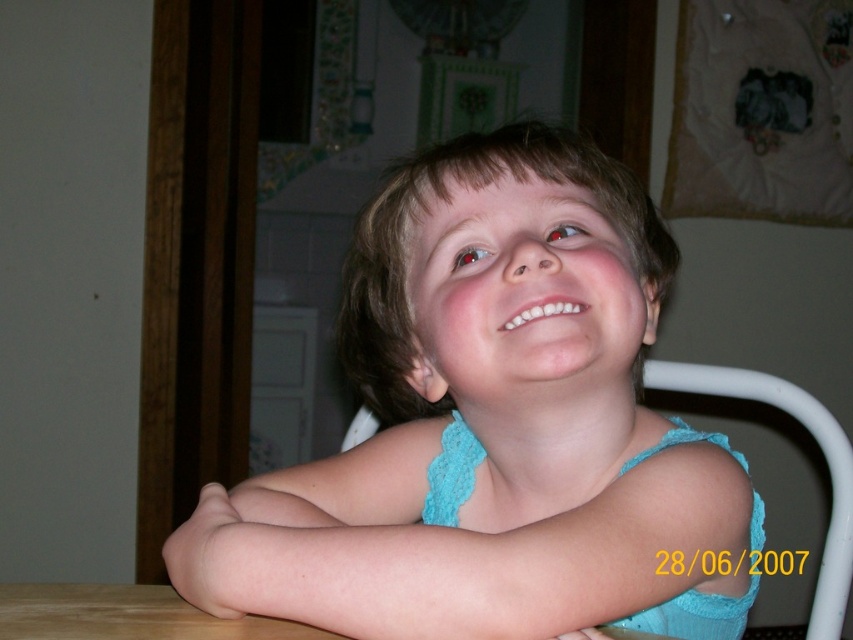
Is point (463, 529) more distant than point (814, 593)?

That is False.

What do you see at coordinates (456, 545) in the screenshot? I see `smooth skin at lower center` at bounding box center [456, 545].

Is point (585, 624) positioned in front of point (370, 435)?

Yes, point (585, 624) is in front of point (370, 435).

At what (x,y) coordinates should I click in order to perform the action: click on smooth skin at lower center. Please return your answer as a coordinate pair (x, y). Image resolution: width=853 pixels, height=640 pixels. Looking at the image, I should click on (456, 545).

Between light blue fabric at center and white plastic chair at center, which one has less height?

With less height is white plastic chair at center.

Does light blue fabric at center appear on the left side of white plastic chair at center?

Yes, light blue fabric at center is to the left of white plastic chair at center.

Describe the element at coordinates (492, 424) in the screenshot. I see `light blue fabric at center` at that location.

Where is `light blue fabric at center`? The width and height of the screenshot is (853, 640). light blue fabric at center is located at coordinates (492, 424).

Locate an element on the screen. light blue fabric at center is located at coordinates [x=492, y=424].

Is light blue fabric at center shorter than smooth skin at lower center?

No.

Is point (322, 509) closer to camera compared to point (437, 612)?

No.

I want to click on light blue fabric at center, so click(492, 424).